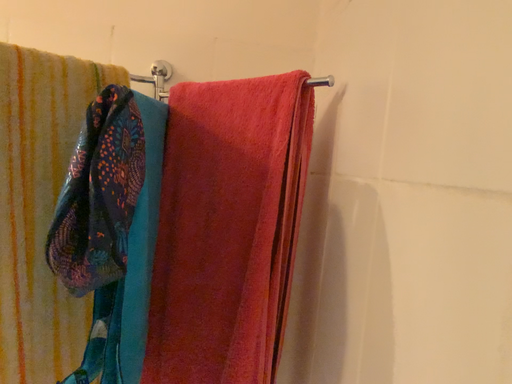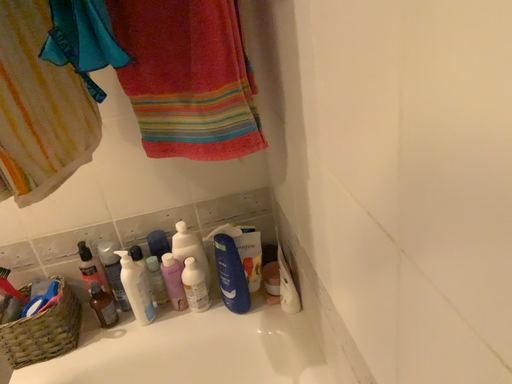
Question: Which way did the camera rotate in the video?

Choices:
 (A) rotated right
 (B) rotated left

Answer: (A)